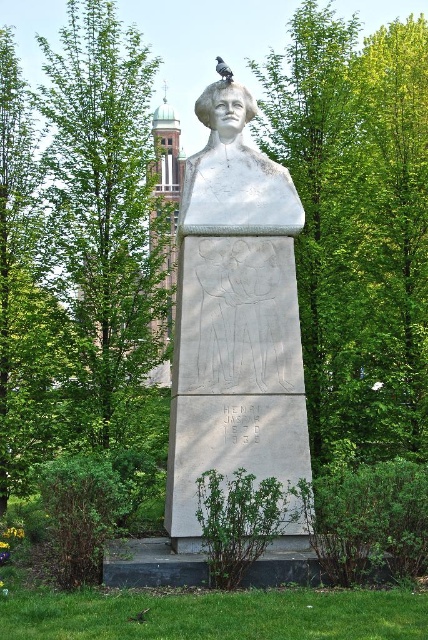
Which is below, white stone bust at center or white marble bust at upper center?

white stone bust at center

Is white stone bust at center smaller than white marble bust at upper center?

No, white stone bust at center is not smaller than white marble bust at upper center.

Locate an element on the screen. The image size is (428, 640). white stone bust at center is located at coordinates pos(234,316).

Is white stone bust at center positioned at the back of green leafy tree at upper left?

No, it is in front of green leafy tree at upper left.

Who is positioned more to the left, white stone bust at center or green leafy tree at upper left?

From the viewer's perspective, green leafy tree at upper left appears more on the left side.

Between point (264, 433) and point (107, 12), which one is positioned behind?

Positioned behind is point (107, 12).

Find the location of a particular element. This screenshot has width=428, height=640. white stone bust at center is located at coordinates (234, 316).

Does point (59, 214) come farther from viewer compared to point (238, 177)?

That is True.

Does point (98, 433) come behind point (246, 209)?

That is True.

I want to click on green leafy tree at upper left, so click(107, 200).